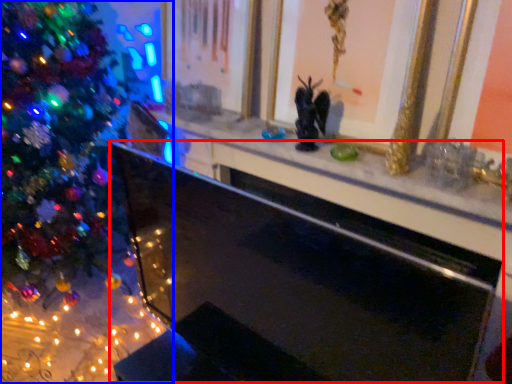
Question: Which object appears farthest to the camera in this image, fireplace (highlighted by a red box) or christmas tree (highlighted by a blue box)?

Choices:
 (A) fireplace
 (B) christmas tree

Answer: (B)